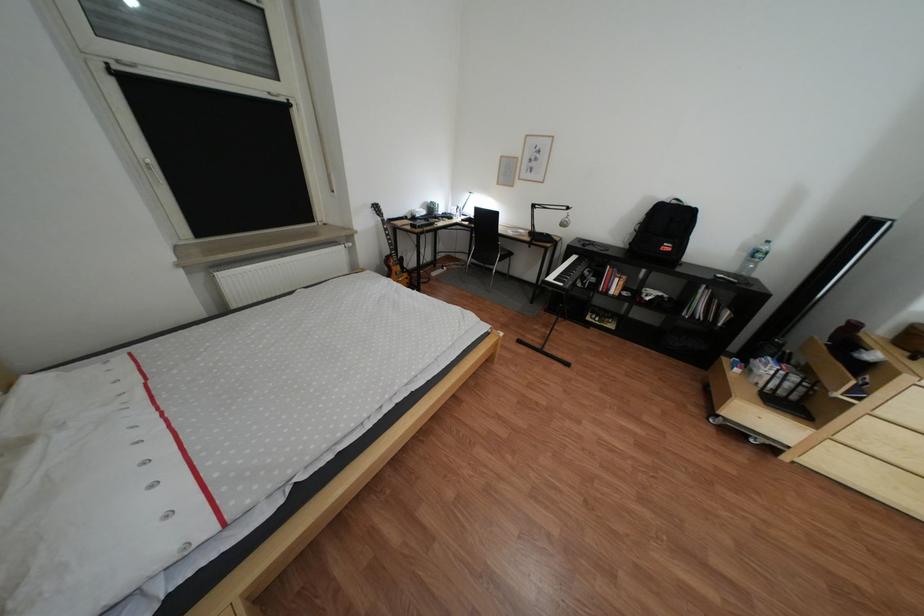
The height and width of the screenshot is (616, 924). What do you see at coordinates (707, 309) in the screenshot?
I see `the book on shelf` at bounding box center [707, 309].